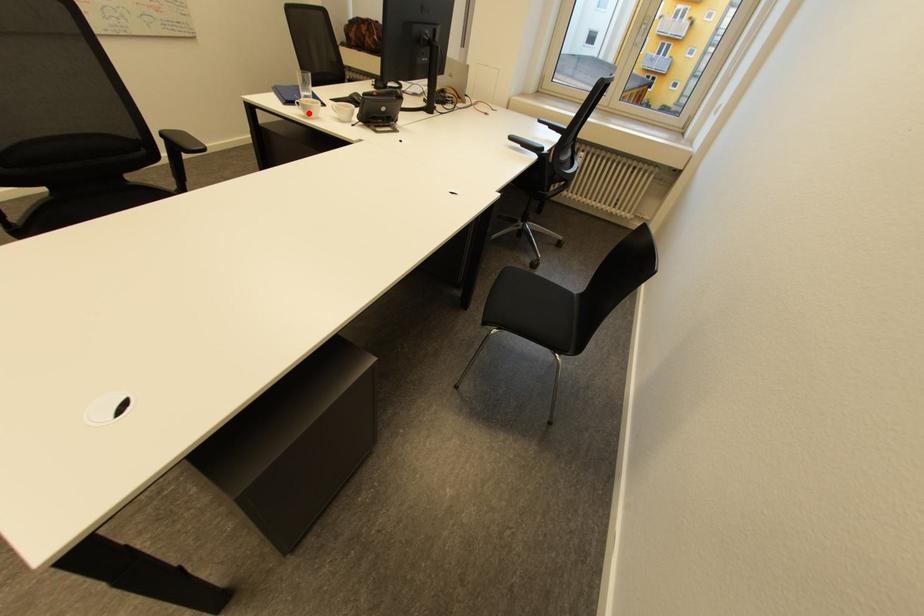
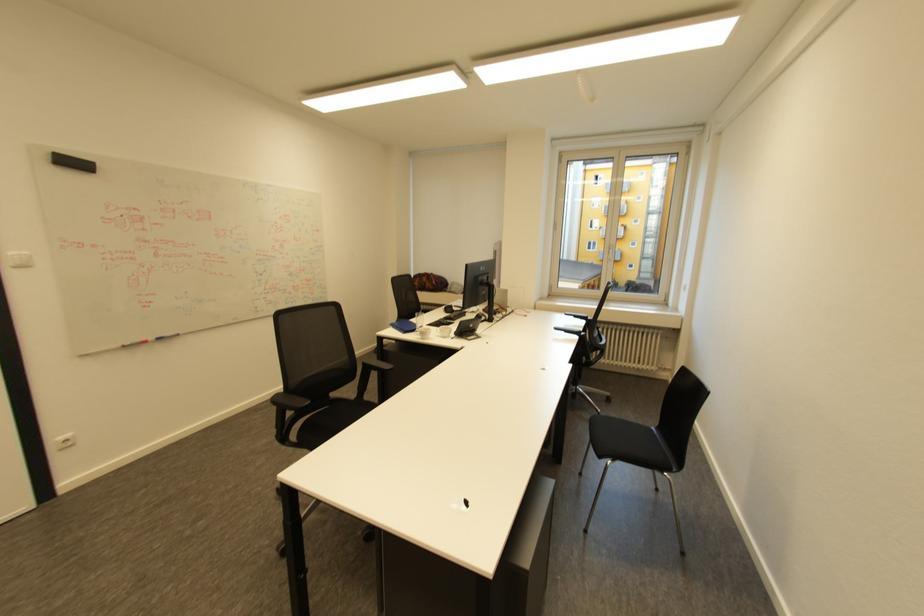
Question: I am providing you with two images of the same scene from different viewpoints. A red point is marked on the first image. Can you still see the location of the red point in image 2?

Choices:
 (A) Yes
 (B) No

Answer: (A)